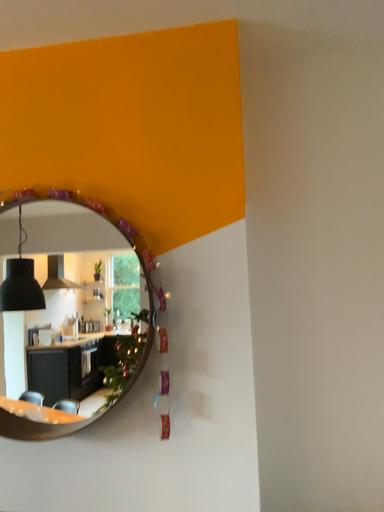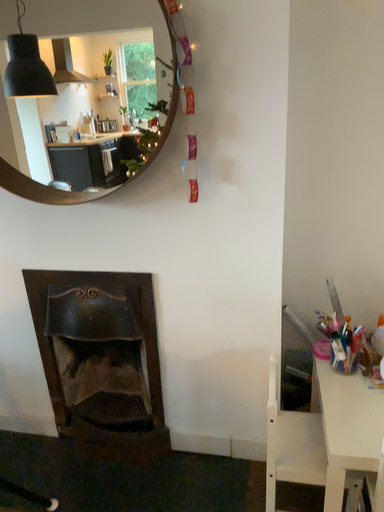
Question: Which way did the camera rotate in the video?

Choices:
 (A) rotated downward
 (B) rotated upward

Answer: (A)